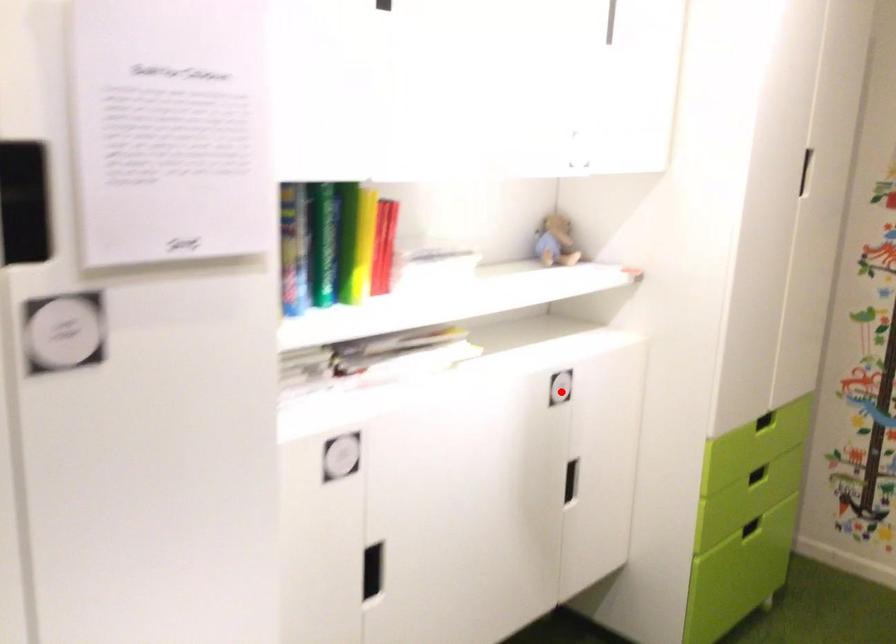
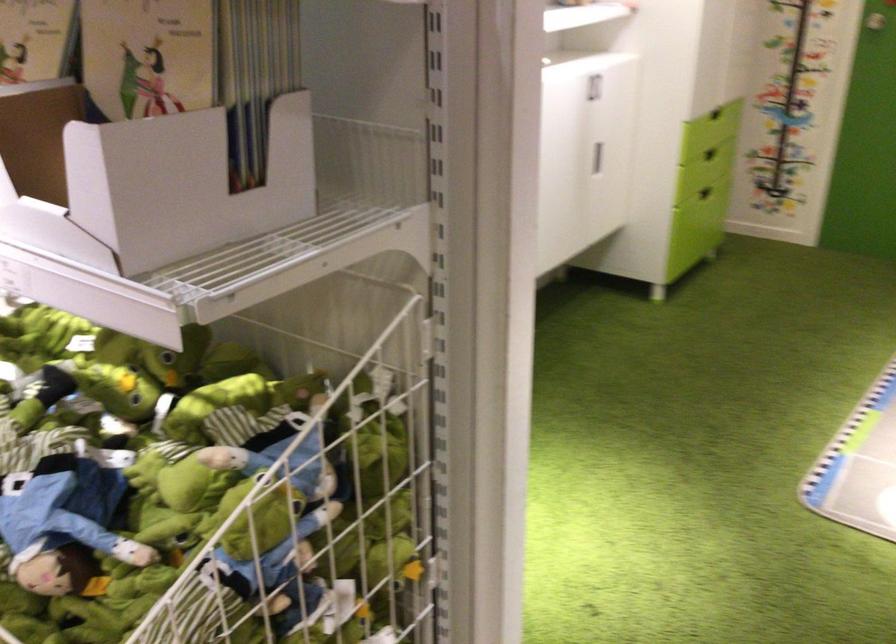
Question: I am providing you with two images of the same scene from different viewpoints. Given a red point in image1, look at the same physical point in image2. Is it:

Choices:
 (A) Closer to the viewpoint
 (B) Farther from the viewpoint

Answer: (B)